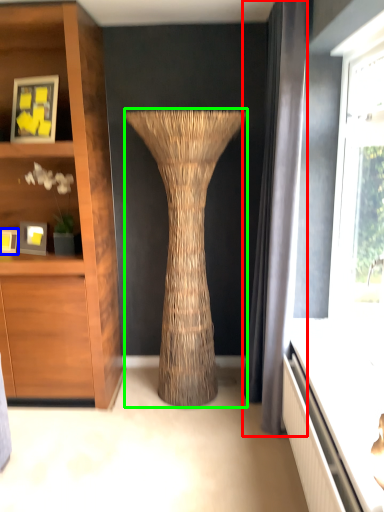
Question: Estimate the real-world distances between objects in this image. Which object is farther from curtain (highlighted by a red box), picture frame (highlighted by a blue box) or vase (highlighted by a green box)?

Choices:
 (A) picture frame
 (B) vase

Answer: (A)